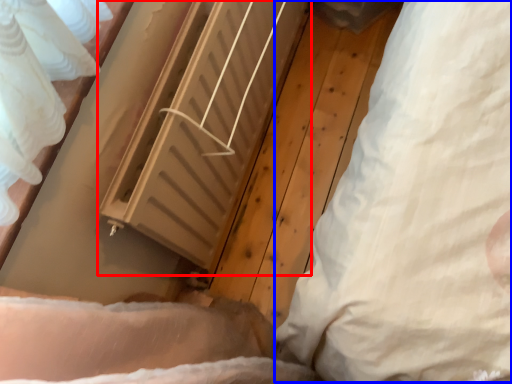
Question: Which point is closer to the camera, radiator (highlighted by a red box) or pillow (highlighted by a blue box)?

Choices:
 (A) radiator
 (B) pillow

Answer: (B)